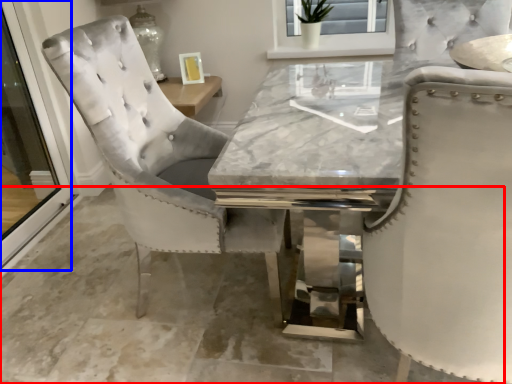
Question: Which object appears closest to the camera in this image, concrete (highlighted by a red box) or screen door (highlighted by a blue box)?

Choices:
 (A) concrete
 (B) screen door

Answer: (A)